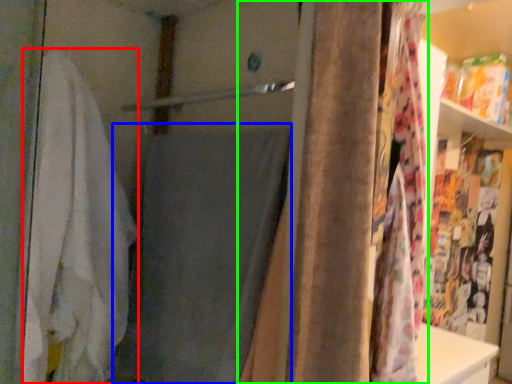
Question: Which object is the farthest from bath towel (highlighted by a red box)? Choose among these: bath towel (highlighted by a blue box) or curtain (highlighted by a green box).

Choices:
 (A) bath towel
 (B) curtain

Answer: (B)